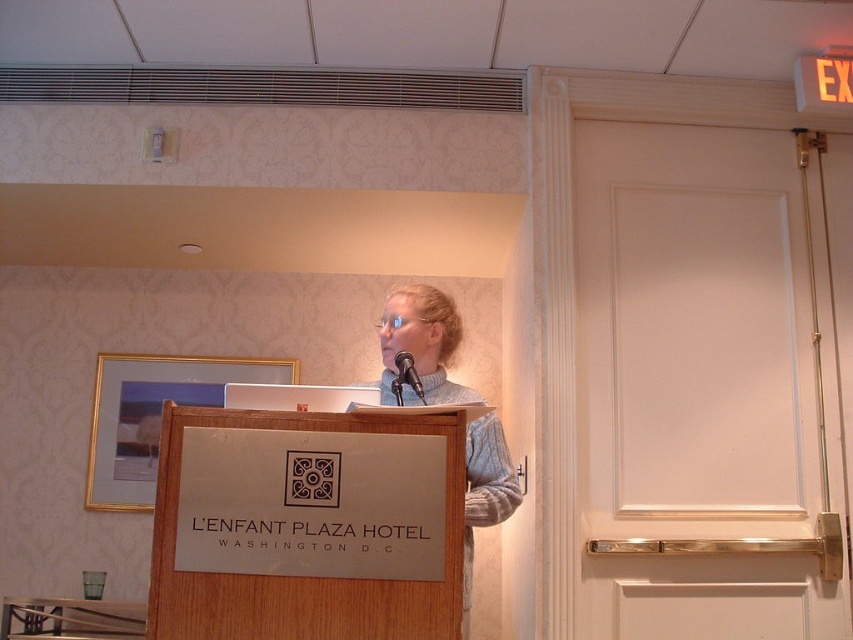
This screenshot has height=640, width=853. What do you see at coordinates (422, 342) in the screenshot?
I see `gray wool sweater at center` at bounding box center [422, 342].

Does gray wool sweater at center have a greater height compared to black metallic microphone at center?

Yes.

What do you see at coordinates (422, 342) in the screenshot? I see `gray wool sweater at center` at bounding box center [422, 342].

Find the location of a particular element. gray wool sweater at center is located at coordinates tap(422, 342).